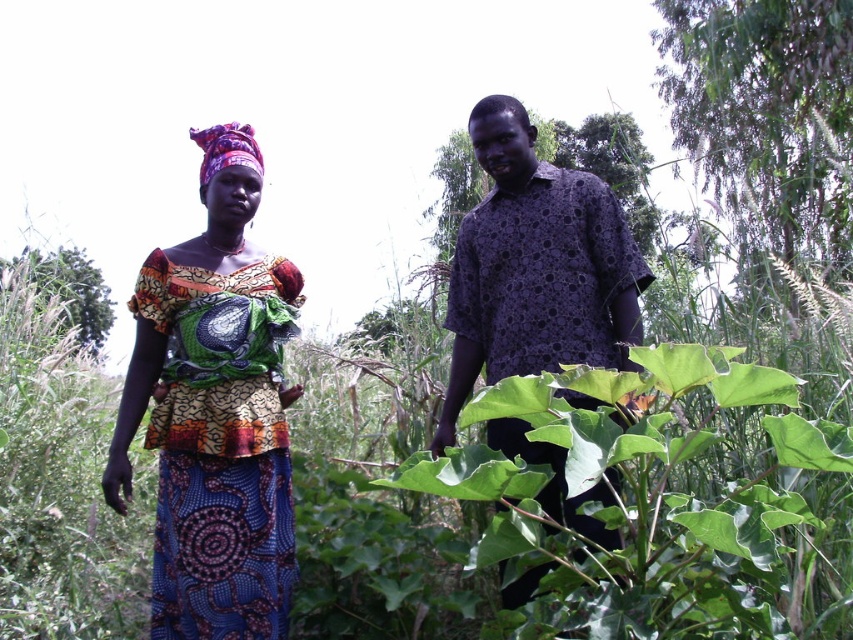
Question: Considering the relative positions of green leafy plant at center and purple printed shirt at center in the image provided, where is green leafy plant at center located with respect to purple printed shirt at center?

Choices:
 (A) right
 (B) left

Answer: (A)

Question: Does printed fabric dress at left appear under purple printed shirt at center?

Choices:
 (A) no
 (B) yes

Answer: (B)

Question: Which point is closer to the camera taking this photo?

Choices:
 (A) (585, 396)
 (B) (254, 205)

Answer: (A)

Question: Which object is farther from the camera taking this photo?

Choices:
 (A) purple printed shirt at center
 (B) green leafy plant at center

Answer: (A)

Question: Does green leafy plant at center appear under purple printed shirt at center?

Choices:
 (A) yes
 (B) no

Answer: (A)

Question: Which object appears closest to the camera in this image?

Choices:
 (A) purple printed shirt at center
 (B) green leafy plant at center

Answer: (B)